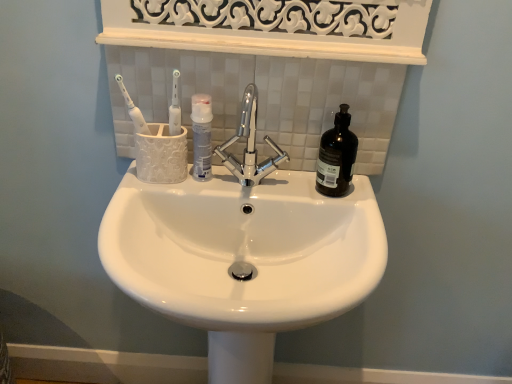
Image resolution: width=512 pixels, height=384 pixels. In order to click on free space in front of black glass bottle at right, which ranks as the first mouthwash in right-to-left order in this screenshot , I will do `click(345, 201)`.